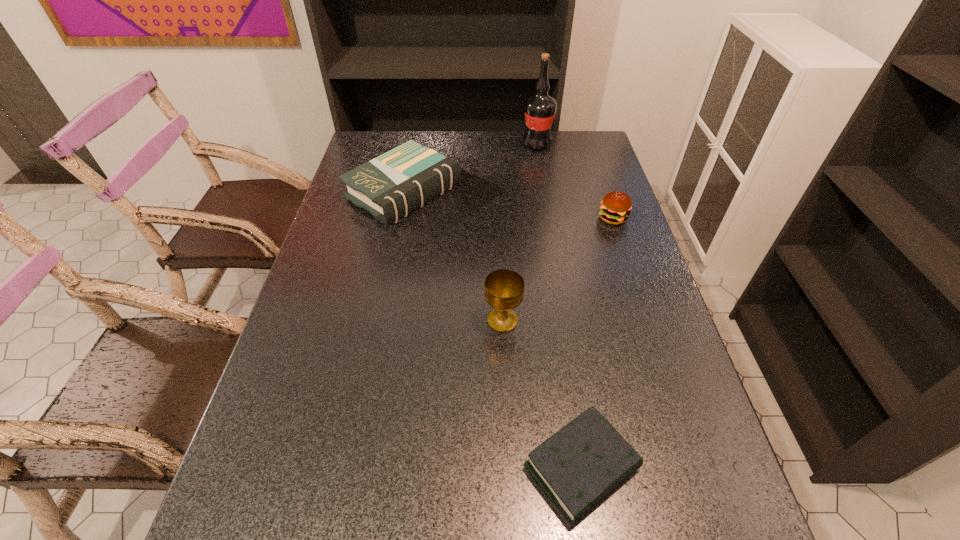
In order to click on vacant space situated 0.070m on the front of the paperback book in this screenshot , I will do `click(393, 246)`.

In order to click on vacant region located 0.370m on the left of the hamburger in this screenshot , I will do `click(475, 218)`.

This screenshot has width=960, height=540. I want to click on vacant space situated 0.270m on the left of the shortest object, so click(380, 468).

Image resolution: width=960 pixels, height=540 pixels. What are the coordinates of `wine bottle that is at the far edge` in the screenshot? It's located at (540, 109).

The image size is (960, 540). Find the location of `paperback book that is positioned at the far edge`. paperback book that is positioned at the far edge is located at coordinates [395, 183].

The image size is (960, 540). Find the location of `object that is at the left edge`. object that is at the left edge is located at coordinates (395, 183).

Where is `hamburger that is at the right edge`? The width and height of the screenshot is (960, 540). hamburger that is at the right edge is located at coordinates (615, 208).

Where is `Bible that is at the right edge`? Bible that is at the right edge is located at coordinates [577, 467].

The height and width of the screenshot is (540, 960). What are the coordinates of `object present at the far left corner` in the screenshot? It's located at coord(395,183).

The height and width of the screenshot is (540, 960). I want to click on free space at the far edge of the desktop, so click(432, 144).